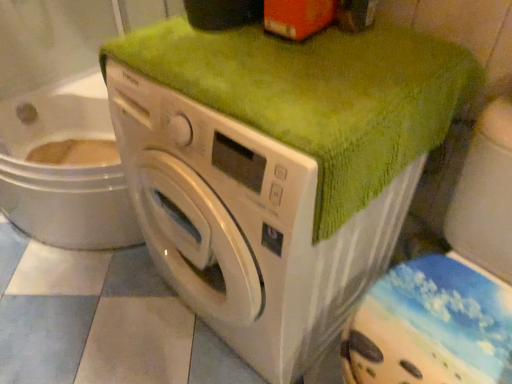
Question: Is point (480, 226) closer or farther from the camera than point (286, 44)?

Choices:
 (A) farther
 (B) closer

Answer: (A)

Question: From a real-world perspective, is green fabric-covered washer at right above or below green textured towel at upper center?

Choices:
 (A) above
 (B) below

Answer: (B)

Question: Considering the real-world distances, which object is farthest from the green textured towel at upper center?

Choices:
 (A) green fabric-covered washer at right
 (B) white glossy washing machine at center

Answer: (A)

Question: Estimate the real-world distances between objects in this image. Which object is farther from the green fabric-covered washer at right?

Choices:
 (A) green textured towel at upper center
 (B) white glossy washing machine at center

Answer: (A)